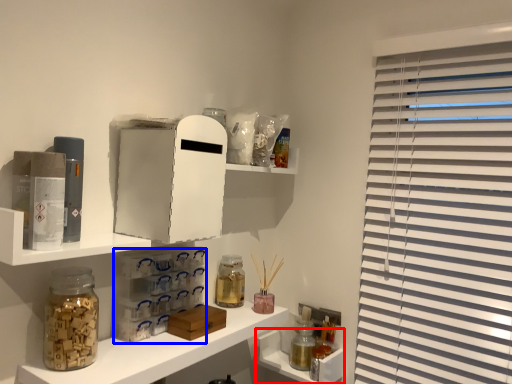
Question: Among these objects, which one is nearest to the camera, cabinet (highlighted by a red box) or cabinet (highlighted by a blue box)?

Choices:
 (A) cabinet
 (B) cabinet

Answer: (B)